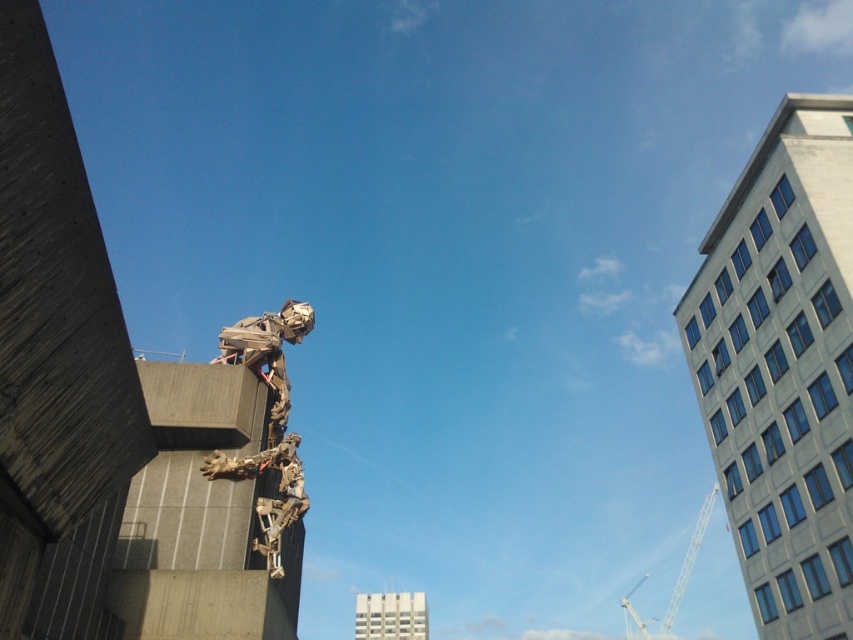
In the scene shown: Does wooden sculpture at center have a lesser height compared to metallic silver crane at upper right?

Correct, wooden sculpture at center is not as tall as metallic silver crane at upper right.

Measure the distance between wooden sculpture at center and camera.

wooden sculpture at center is 111.08 feet away from camera.

Between point (268, 380) and point (692, 540), which one is positioned in front?

Point (268, 380)

Where is `wooden sculpture at center`? wooden sculpture at center is located at coordinates (268, 420).